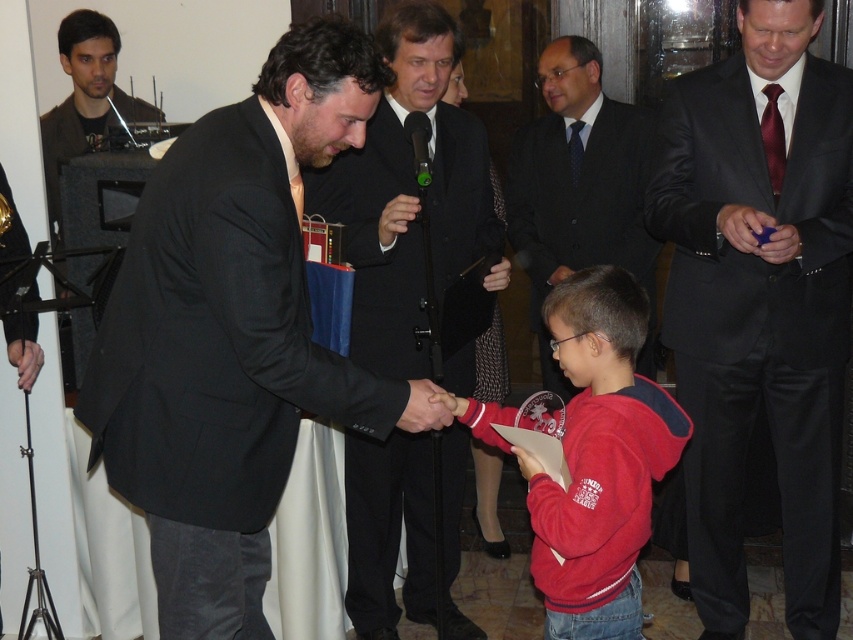
Question: Is shiny black suit at center positioned in front of matte black suit at upper left?

Choices:
 (A) yes
 (B) no

Answer: (A)

Question: Can you confirm if shiny black suit at center is thinner than red fleece jacket at lower center?

Choices:
 (A) no
 (B) yes

Answer: (A)

Question: Is black matte suit at center positioned before shiny black suit at center?

Choices:
 (A) yes
 (B) no

Answer: (A)

Question: Which point is closer to the camera?

Choices:
 (A) (733, 138)
 (B) (585, 109)

Answer: (A)

Question: Which of these objects is positioned closest to the dark suit at center?

Choices:
 (A) shiny black suit at center
 (B) black matte suit at center

Answer: (A)

Question: Which object appears farthest from the camera in this image?

Choices:
 (A) black suit at center
 (B) shiny black suit at center

Answer: (A)